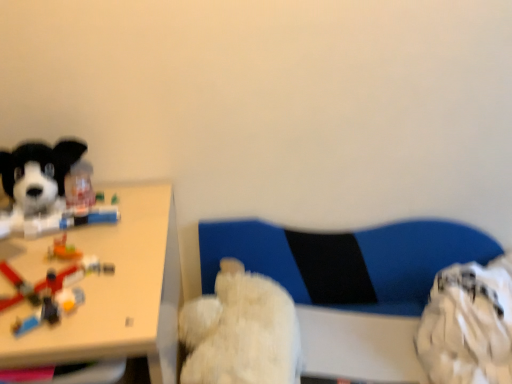
Question: Is translucent plastic toy at left positioned with its back to blue fabric swivel chair at center?

Choices:
 (A) no
 (B) yes

Answer: (A)

Question: Is the position of translucent plastic toy at left more distant than that of blue fabric swivel chair at center?

Choices:
 (A) no
 (B) yes

Answer: (A)

Question: From the image's perspective, does translucent plastic toy at left appear higher than blue fabric swivel chair at center?

Choices:
 (A) yes
 (B) no

Answer: (A)

Question: Does translucent plastic toy at left have a greater width compared to blue fabric swivel chair at center?

Choices:
 (A) no
 (B) yes

Answer: (B)

Question: Does translucent plastic toy at left have a larger size compared to blue fabric swivel chair at center?

Choices:
 (A) no
 (B) yes

Answer: (A)

Question: From a real-world perspective, is translucent plastic toy at left positioned under blue fabric swivel chair at center based on gravity?

Choices:
 (A) yes
 (B) no

Answer: (B)

Question: Is soft plush dog at left, which is the first dog in top-to-bottom order, smaller than translucent plastic toy at left?

Choices:
 (A) yes
 (B) no

Answer: (B)

Question: Is soft plush dog at left, which ranks as the second dog in right-to-left order, not close to translucent plastic toy at left?

Choices:
 (A) yes
 (B) no

Answer: (B)

Question: Is translucent plastic toy at left located within soft plush dog at left, which is the first dog in top-to-bottom order?

Choices:
 (A) no
 (B) yes

Answer: (A)

Question: From a real-world perspective, is soft plush dog at left, which is counted as the 2th dog, starting from the bottom, on translucent plastic toy at left?

Choices:
 (A) no
 (B) yes

Answer: (B)

Question: Considering the relative sizes of soft plush dog at left, the 1th dog when ordered from left to right, and translucent plastic toy at left in the image provided, is soft plush dog at left, the 1th dog when ordered from left to right, wider than translucent plastic toy at left?

Choices:
 (A) yes
 (B) no

Answer: (A)

Question: Is soft plush dog at left, which ranks as the second dog in right-to-left order, outside translucent plastic toy at left?

Choices:
 (A) no
 (B) yes

Answer: (B)

Question: From the image's perspective, is fluffy white teddy bear at center, which is the 1th dog in right-to-left order, located above soft plush dog at left, which is counted as the 2th dog, starting from the bottom?

Choices:
 (A) yes
 (B) no

Answer: (B)